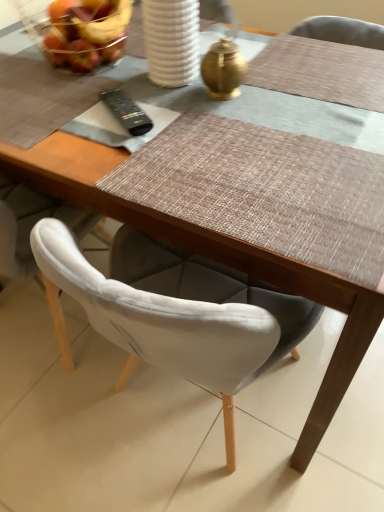
Find the location of `vacant area situated to the left side of black plastic remote at center`. vacant area situated to the left side of black plastic remote at center is located at coordinates (53, 116).